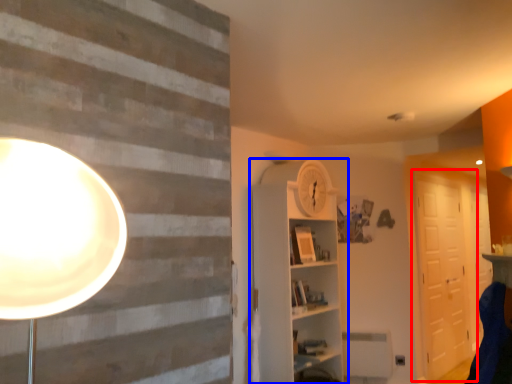
Question: Which point is further to the camera, barn door (highlighted by a red box) or shelf (highlighted by a blue box)?

Choices:
 (A) barn door
 (B) shelf

Answer: (A)